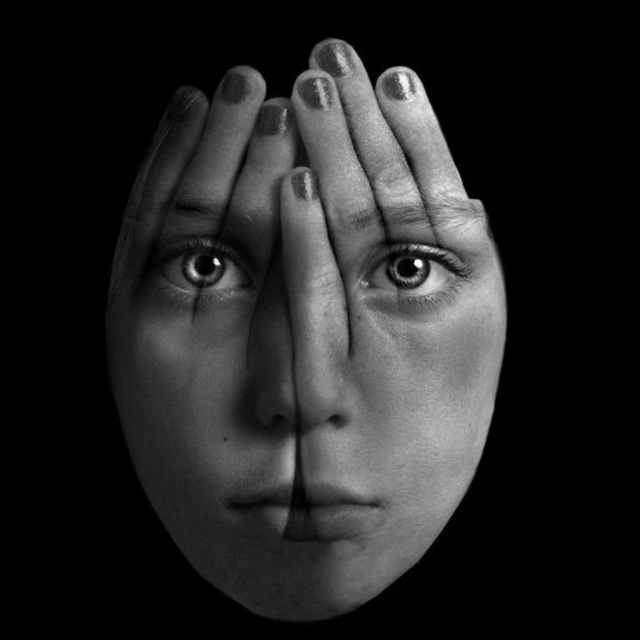
Which is more to the left, smooth skin forehead at center or smooth gray eye at center?

From the viewer's perspective, smooth gray eye at center appears more on the left side.

The width and height of the screenshot is (640, 640). Describe the element at coordinates (413, 220) in the screenshot. I see `smooth skin forehead at center` at that location.

This screenshot has width=640, height=640. Identify the location of smooth skin forehead at center. (413, 220).

In the scene shown: Is shiny gray eye at center bigger than smooth gray eye at center?

Yes, shiny gray eye at center is bigger than smooth gray eye at center.

Is point (390, 253) farther from camera compared to point (243, 289)?

Yes, point (390, 253) is behind point (243, 289).

Is point (426, 272) farther from camera compared to point (189, 246)?

Yes, it is behind point (189, 246).

Image resolution: width=640 pixels, height=640 pixels. Find the location of `shiny gray eye at center`. shiny gray eye at center is located at coordinates (x=412, y=269).

Is smooth skin forehead at center to the right of shiny gray eye at center from the viewer's perspective?

Correct, you'll find smooth skin forehead at center to the right of shiny gray eye at center.

Which is more to the right, smooth skin forehead at center or shiny gray eye at center?

smooth skin forehead at center is more to the right.

What are the coordinates of `smooth skin forehead at center` in the screenshot? It's located at [x=413, y=220].